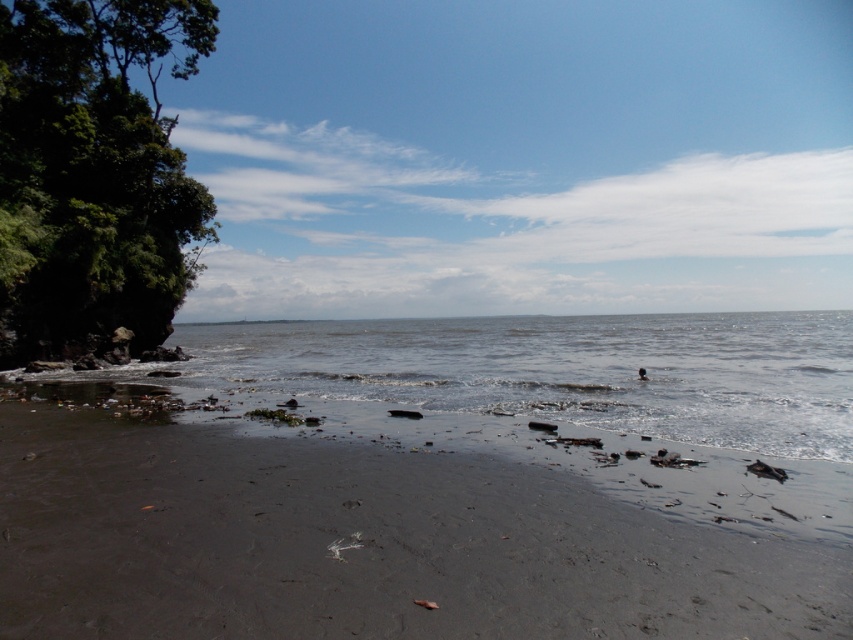
Between point (469, 604) and point (73, 278), which one is positioned behind?

Positioned behind is point (73, 278).

You are a GUI agent. You are given a task and a screenshot of the screen. Output one action in this format:
    pyautogui.click(x=<x>, y=<y>)
    Task: Click on the dark gray sand at lower center
    The image size is (853, 640).
    Given the screenshot: What is the action you would take?
    click(x=363, y=545)

Identify the location of dark gray sand at lower center. (363, 545).